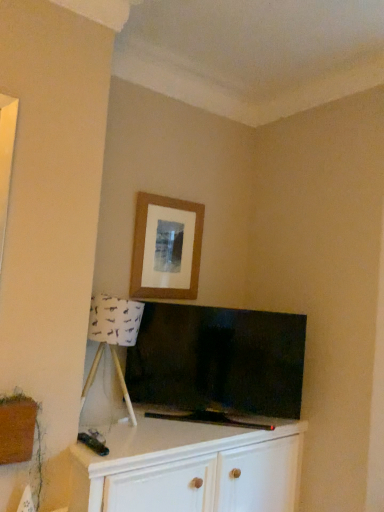
Question: Is wooden picture frame at upper center positioned before white fabric lampshade at lower left?

Choices:
 (A) no
 (B) yes

Answer: (A)

Question: Can you confirm if wooden picture frame at upper center is wider than white fabric lampshade at lower left?

Choices:
 (A) no
 (B) yes

Answer: (A)

Question: Can you confirm if wooden picture frame at upper center is positioned to the left of white fabric lampshade at lower left?

Choices:
 (A) yes
 (B) no

Answer: (B)

Question: Is wooden picture frame at upper center further to camera compared to white fabric lampshade at lower left?

Choices:
 (A) no
 (B) yes

Answer: (B)

Question: From the image's perspective, is wooden picture frame at upper center located above white fabric lampshade at lower left?

Choices:
 (A) yes
 (B) no

Answer: (A)

Question: Relative to flat-screen tv at center, is white wood cabinet at lower center in front or behind?

Choices:
 (A) behind
 (B) front

Answer: (B)

Question: In terms of height, does white wood cabinet at lower center look taller or shorter compared to flat-screen tv at center?

Choices:
 (A) short
 (B) tall

Answer: (B)

Question: From a real-world perspective, relative to flat-screen tv at center, is white wood cabinet at lower center vertically above or below?

Choices:
 (A) below
 (B) above

Answer: (A)

Question: In terms of width, does white wood cabinet at lower center look wider or thinner when compared to flat-screen tv at center?

Choices:
 (A) wide
 (B) thin

Answer: (A)

Question: Considering the positions of point (99, 307) and point (127, 362), is point (99, 307) closer or farther from the camera than point (127, 362)?

Choices:
 (A) farther
 (B) closer

Answer: (B)

Question: From the image's perspective, is white fabric lampshade at lower left above or below flat-screen tv at center?

Choices:
 (A) below
 (B) above

Answer: (B)

Question: From a real-world perspective, is white fabric lampshade at lower left physically located above or below flat-screen tv at center?

Choices:
 (A) below
 (B) above

Answer: (B)

Question: Considering their positions, is white fabric lampshade at lower left located in front of or behind flat-screen tv at center?

Choices:
 (A) front
 (B) behind

Answer: (A)

Question: Is point (148, 228) closer or farther from the camera than point (246, 333)?

Choices:
 (A) closer
 (B) farther

Answer: (B)

Question: Based on their sizes in the image, would you say wooden picture frame at upper center is bigger or smaller than flat-screen tv at center?

Choices:
 (A) big
 (B) small

Answer: (B)